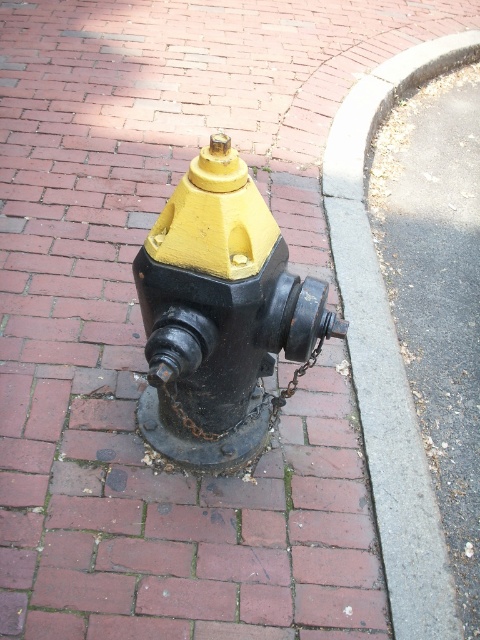
You are a city planner reviewing a blueprint and notice the matte black fire hydrant at center. What are the coordinates of this hydrant on the blueprint?

The coordinates of the matte black fire hydrant at center are point (218, 314).

You are a delivery driver who needs to park your vehicle near the gray concrete curb at lower right and the rusty metal chain at center. Which object is closer to the curb?

The gray concrete curb at lower right is positioned on the right side of the rusty metal chain at center, so the curb is closer to the curb itself. Wait, that seems redundant. Let me rephrase. Since the curb is on the right side of the chain, the chain is to the left of the curb. Therefore, the rusty metal chain at center is closer to the gray concrete curb at lower right than the curb is to itself. Hmm, maybe better to say the chain is closer to the curb than the curb is to itself? That doesn